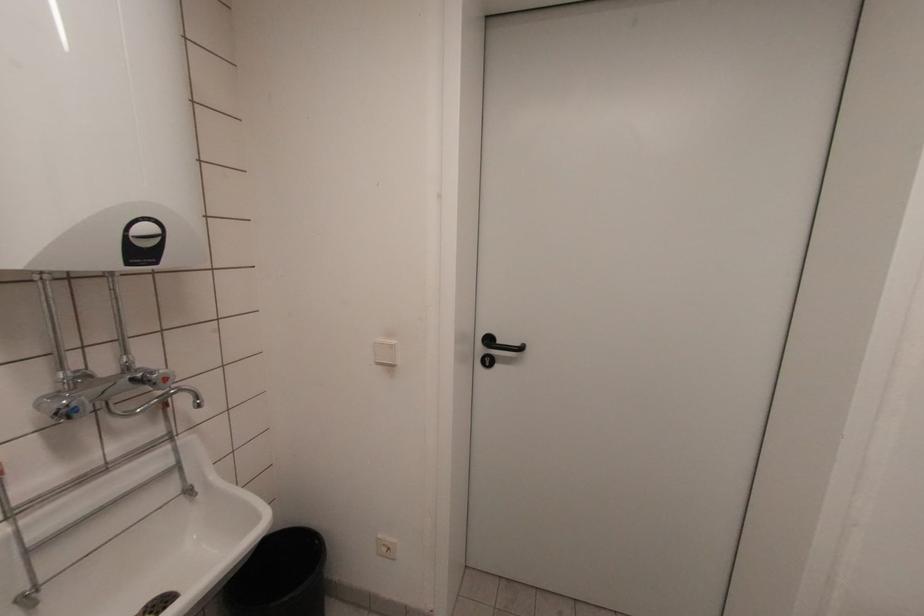
At what (x,y) coordinates should I click in order to perform the action: click on black control dial. Please return your answer as a coordinate pair (x, y). The height and width of the screenshot is (616, 924). Looking at the image, I should click on (142, 241).